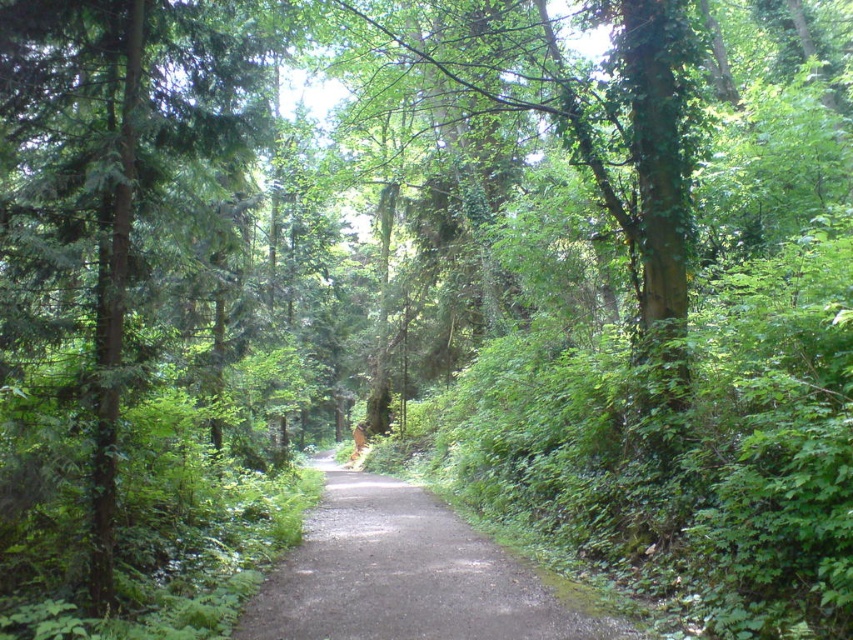
Consider the image. You are a hiker standing on the dull gray asphalt at center and want to take a photo of the green matte tree at left. In which direction should you point your camera to capture the tree in the frame?

You should point your camera to the left because the green matte tree at left is located to the left of the dull gray asphalt at center where you are standing.

You are a hiker who wants to take a photo of the green matte tree at left from exactly 20 feet away. Based on the scene, can you get close enough to take the photo?

The green matte tree at left is 21.00 feet away from the camera, so you cannot get close enough to take the photo from exactly 20 feet away.

You are a hiker standing at the center of the winding dirt path in the forest. You notice a green matte tree at left. Based on its position, can you determine if this tree is to your left or right side relative to the direction you are facing?

The green matte tree at left is located at point (102, 257), which places it to the left side of your position when facing along the path.